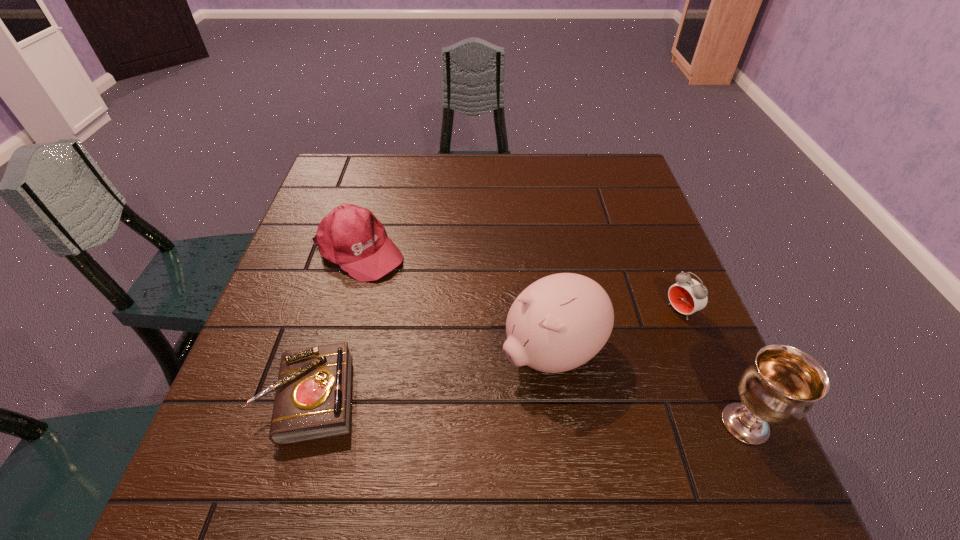
Image resolution: width=960 pixels, height=540 pixels. In order to click on chalice situated at the right edge in this screenshot , I will do `click(781, 385)`.

Locate an element on the screen. This screenshot has width=960, height=540. alarm clock that is at the right edge is located at coordinates (687, 296).

Locate an element on the screen. This screenshot has width=960, height=540. object that is at the near left corner is located at coordinates (313, 393).

Where is `object that is positioned at the near right corner`? object that is positioned at the near right corner is located at coordinates (781, 385).

In the image, there is a desktop. Where is `vacant space at the far edge`? This screenshot has width=960, height=540. vacant space at the far edge is located at coordinates (463, 156).

This screenshot has height=540, width=960. Find the location of `free point at the near edge`. free point at the near edge is located at coordinates coord(385,428).

The width and height of the screenshot is (960, 540). Identify the location of free spot at the left edge of the desktop. (310, 302).

At what (x,y) coordinates should I click in order to perform the action: click on vacant space at the right edge. Please return your answer as a coordinate pair (x, y). Looking at the image, I should click on (647, 253).

The image size is (960, 540). I want to click on vacant space at the far left corner, so click(x=363, y=177).

In the image, there is a desktop. Where is `vacant space at the far right corner`? vacant space at the far right corner is located at coordinates (622, 160).